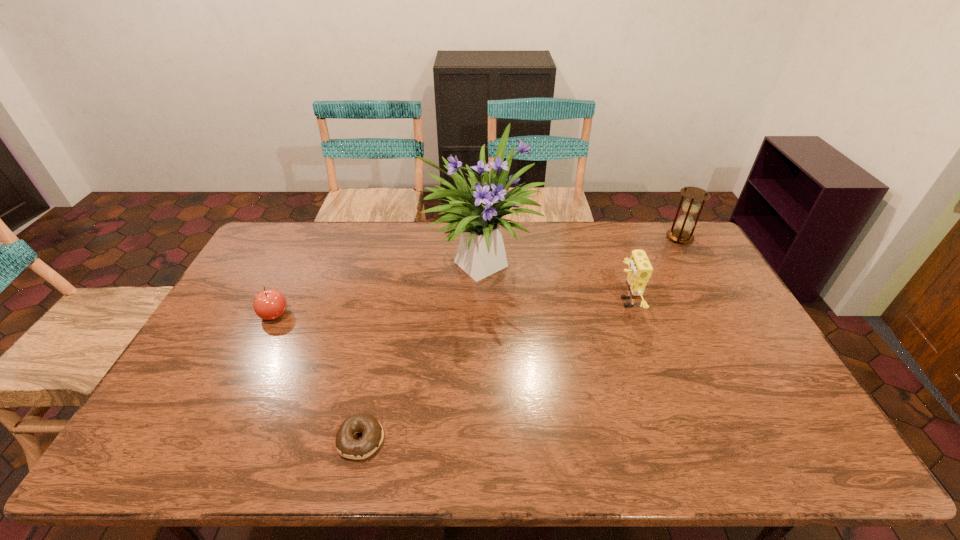
In order to click on the third object from right to left in this screenshot , I will do `click(476, 213)`.

Where is `the tallest object`? the tallest object is located at coordinates (476, 213).

I want to click on hourglass, so click(685, 223).

Find the location of a particular element. The image size is (960, 540). the fourth object from left to right is located at coordinates (640, 269).

At what (x,y) coordinates should I click in order to perform the action: click on the second shortest object. Please return your answer as a coordinate pair (x, y). The width and height of the screenshot is (960, 540). Looking at the image, I should click on (270, 304).

The height and width of the screenshot is (540, 960). Find the location of `apple`. apple is located at coordinates (270, 304).

This screenshot has height=540, width=960. Find the location of `the shortest object`. the shortest object is located at coordinates (347, 446).

Image resolution: width=960 pixels, height=540 pixels. What are the coordinates of `doughnut` in the screenshot? It's located at (347, 446).

I want to click on vacant space located 0.210m on the left of the third object from left to right, so click(x=362, y=259).

Find the location of a particular element. The image size is (960, 540). vacant space located on the front of the rightmost object is located at coordinates (703, 278).